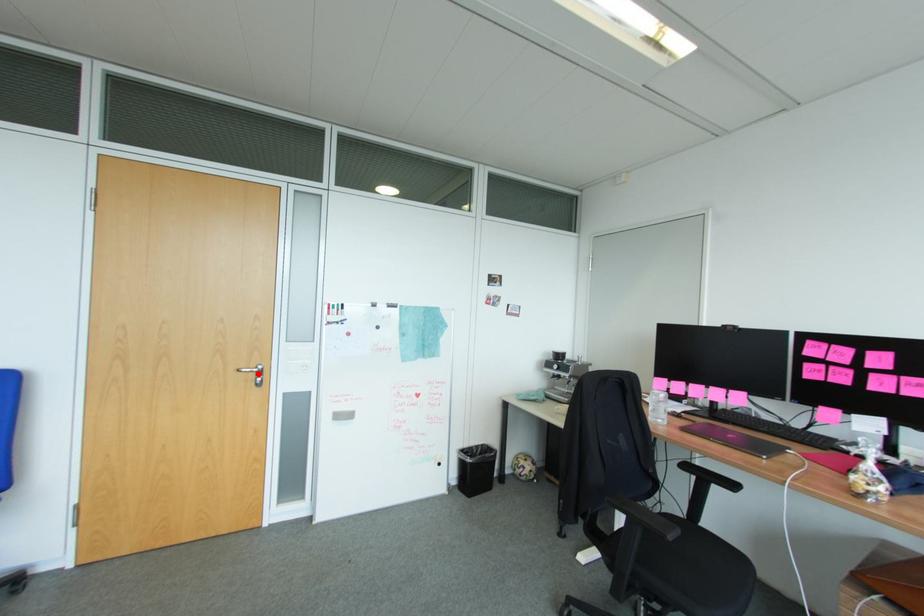
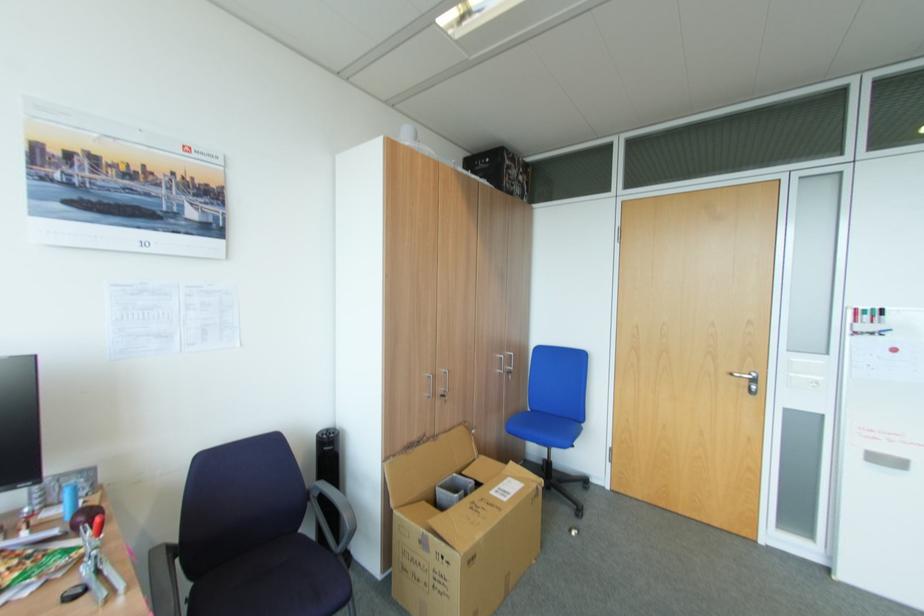
Find the pixel in the second image that matches the highlighted location in the first image.

(751, 381)